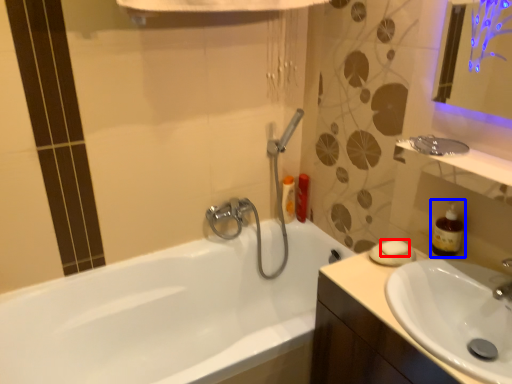
Question: Among these objects, which one is farthest to the camera, soap (highlighted by a red box) or soap dispenser (highlighted by a blue box)?

Choices:
 (A) soap
 (B) soap dispenser

Answer: (A)